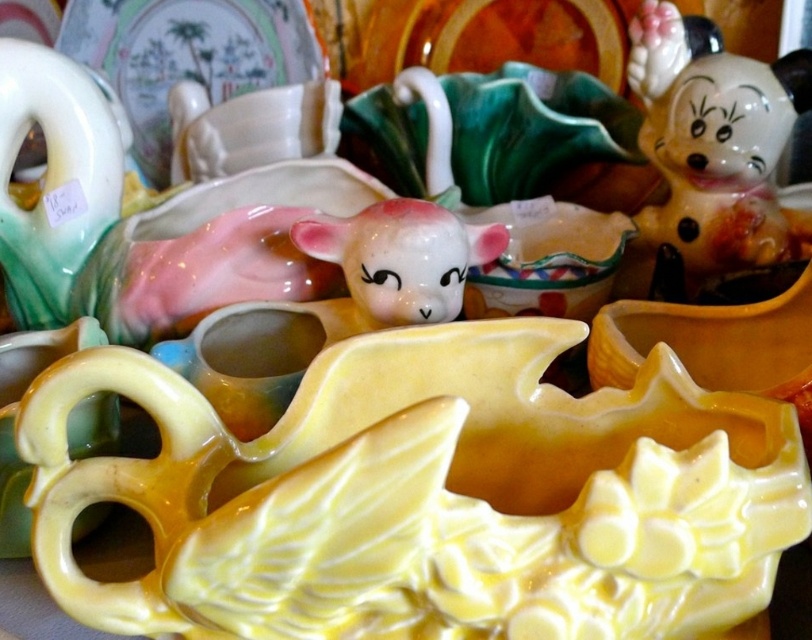
Which of these two, white glossy minnie mouse figurine at upper right or matte porcelain lamb at center, stands taller?

white glossy minnie mouse figurine at upper right

Is point (720, 227) more distant than point (309, 234)?

That is True.

Does point (741, 72) come behind point (387, 300)?

Yes, it is behind point (387, 300).

Locate an element on the screen. The height and width of the screenshot is (640, 812). white glossy minnie mouse figurine at upper right is located at coordinates (711, 148).